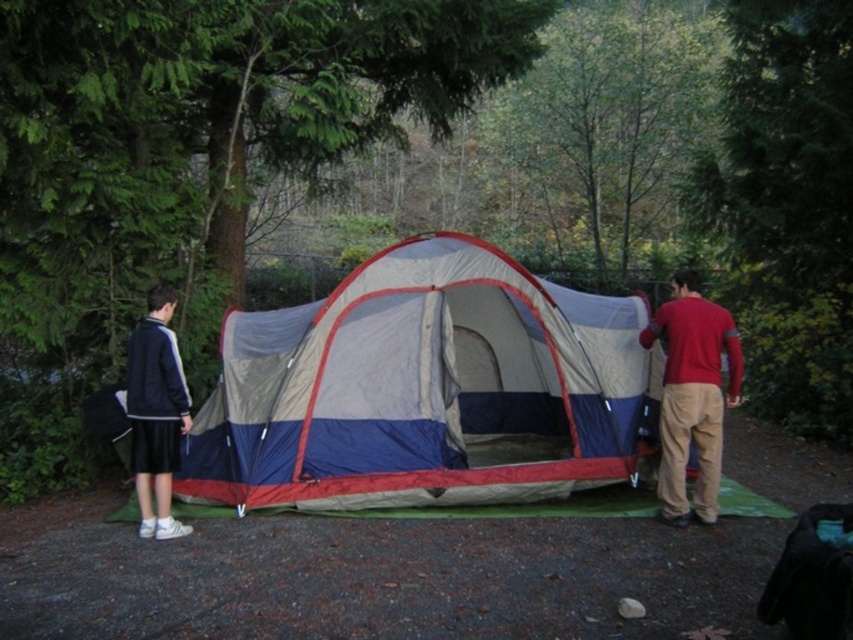
You are standing at point (175, 529) and want to walk to the tent entrance. Is there an obstacle between your current position and the tent entrance located at point (454, 416)?

Point (454, 416) is behind point (175, 529), so there is an obstacle between your current position and the tent entrance.

You are a hiker who wants to set up a tent. You have a blue tarpaulin tent at center and a dark blue jacket at left. Which item is closer to you?

The blue tarpaulin tent at center is closer to you because it is further to the viewer than the dark blue jacket at left, meaning it appears nearer in the image.